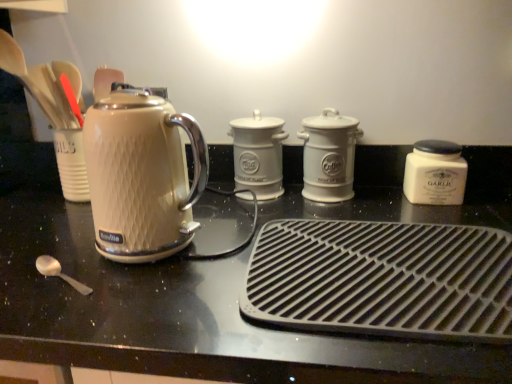
Identify the location of matte cream kettle at left. Image resolution: width=512 pixels, height=384 pixels. pyautogui.click(x=141, y=175).

Describe the element at coordinates (174, 308) in the screenshot. The height and width of the screenshot is (384, 512). I see `matte white kettle at left` at that location.

Measure the distance between white ceramic canister at center, arranged as the fourth kitchen appliance when viewed from the front, and camera.

white ceramic canister at center, arranged as the fourth kitchen appliance when viewed from the front, and camera are 34.98 inches apart.

Find the location of `white ceramic coffee canister at center, acting as the 2th kitchen appliance starting from the back`. white ceramic coffee canister at center, acting as the 2th kitchen appliance starting from the back is located at coordinates (329, 156).

Identify the location of black rubber mat at center, placed as the fourth kitchen appliance when sorted from back to front. (382, 279).

You are a GUI agent. You are given a task and a screenshot of the screen. Output one action in this format:
    pyautogui.click(x=<x>, y=<y>)
    Task: Click on the matte cream kettle at left
    
    Given the screenshot: What is the action you would take?
    pyautogui.click(x=141, y=175)

Is white ceramic jar at right, which is counted as the third kitchen appliance, starting from the back, to the left of white ceramic canister at center, arranged as the fourth kitchen appliance when viewed from the front, from the viewer's perspective?

In fact, white ceramic jar at right, which is counted as the third kitchen appliance, starting from the back, is to the right of white ceramic canister at center, arranged as the fourth kitchen appliance when viewed from the front.

Is white ceramic jar at right, acting as the 2th kitchen appliance starting from the front, next to white ceramic canister at center, placed as the 1th kitchen appliance when sorted from back to front, and touching it?

No, white ceramic jar at right, acting as the 2th kitchen appliance starting from the front, is not next to white ceramic canister at center, placed as the 1th kitchen appliance when sorted from back to front.

From the image's perspective, between white ceramic jar at right, acting as the 2th kitchen appliance starting from the front, and white ceramic canister at center, arranged as the fourth kitchen appliance when viewed from the front, who is located below?

white ceramic jar at right, acting as the 2th kitchen appliance starting from the front, is shown below in the image.

In the scene shown: From the image's perspective, which is above, black rubber mat at center, which is the first kitchen appliance from front to back, or white ceramic jar at right, which is counted as the third kitchen appliance, starting from the back?

white ceramic jar at right, which is counted as the third kitchen appliance, starting from the back.

Between black rubber mat at center, placed as the fourth kitchen appliance when sorted from back to front, and white ceramic jar at right, acting as the 2th kitchen appliance starting from the front, which one has smaller width?

Thinner between the two is white ceramic jar at right, acting as the 2th kitchen appliance starting from the front.

Measure the distance from black rubber mat at center, placed as the fourth kitchen appliance when sorted from back to front, to white ceramic jar at right, which is counted as the third kitchen appliance, starting from the back.

black rubber mat at center, placed as the fourth kitchen appliance when sorted from back to front, is 12.39 inches from white ceramic jar at right, which is counted as the third kitchen appliance, starting from the back.

From the picture: Considering the relative sizes of black rubber mat at center, which is the first kitchen appliance from front to back, and white ceramic jar at right, which is counted as the third kitchen appliance, starting from the back, in the image provided, is black rubber mat at center, which is the first kitchen appliance from front to back, taller than white ceramic jar at right, which is counted as the third kitchen appliance, starting from the back,?

No, black rubber mat at center, which is the first kitchen appliance from front to back, is not taller than white ceramic jar at right, which is counted as the third kitchen appliance, starting from the back.

Can matte white kettle at left be found inside white ceramic canister at center, arranged as the fourth kitchen appliance when viewed from the front?

No, matte white kettle at left is not inside white ceramic canister at center, arranged as the fourth kitchen appliance when viewed from the front.

In the image, is white ceramic canister at center, arranged as the fourth kitchen appliance when viewed from the front, positioned in front of or behind matte white kettle at left?

Visually, white ceramic canister at center, arranged as the fourth kitchen appliance when viewed from the front, is located behind matte white kettle at left.

From the image's perspective, would you say white ceramic canister at center, arranged as the fourth kitchen appliance when viewed from the front, is shown under matte white kettle at left?

Incorrect, from the image's perspective, white ceramic canister at center, arranged as the fourth kitchen appliance when viewed from the front, is higher than matte white kettle at left.

Considering the relative sizes of white ceramic canister at center, arranged as the fourth kitchen appliance when viewed from the front, and matte white kettle at left in the image provided, is white ceramic canister at center, arranged as the fourth kitchen appliance when viewed from the front, taller than matte white kettle at left?

Incorrect, the height of white ceramic canister at center, arranged as the fourth kitchen appliance when viewed from the front, is not larger of that of matte white kettle at left.

From a real-world perspective, between white ceramic coffee canister at center, the 3th kitchen appliance viewed from the front, and white ceramic canister at center, placed as the 1th kitchen appliance when sorted from back to front, who is vertically higher?

white ceramic canister at center, placed as the 1th kitchen appliance when sorted from back to front, is physically above.

The height and width of the screenshot is (384, 512). What are the coordinates of `the 1st kitchen appliance to the right when counting from the white ceramic canister at center, arranged as the fourth kitchen appliance when viewed from the front` in the screenshot? It's located at (329, 156).

Could you measure the distance between white ceramic coffee canister at center, acting as the 2th kitchen appliance starting from the back, and white ceramic canister at center, arranged as the fourth kitchen appliance when viewed from the front?

white ceramic coffee canister at center, acting as the 2th kitchen appliance starting from the back, is 4.21 inches from white ceramic canister at center, arranged as the fourth kitchen appliance when viewed from the front.

Can you see white ceramic coffee canister at center, acting as the 2th kitchen appliance starting from the back, touching white ceramic canister at center, placed as the 1th kitchen appliance when sorted from back to front?

There is a gap between white ceramic coffee canister at center, acting as the 2th kitchen appliance starting from the back, and white ceramic canister at center, placed as the 1th kitchen appliance when sorted from back to front.

In terms of size, does black rubber mat at center, placed as the fourth kitchen appliance when sorted from back to front, appear bigger or smaller than white ceramic canister at center, arranged as the fourth kitchen appliance when viewed from the front?

Considering their sizes, black rubber mat at center, placed as the fourth kitchen appliance when sorted from back to front, takes up more space than white ceramic canister at center, arranged as the fourth kitchen appliance when viewed from the front.

Which object is positioned more to the left, black rubber mat at center, which is the first kitchen appliance from front to back, or white ceramic canister at center, arranged as the fourth kitchen appliance when viewed from the front?

From the viewer's perspective, white ceramic canister at center, arranged as the fourth kitchen appliance when viewed from the front, appears more on the left side.

Between black rubber mat at center, which is the first kitchen appliance from front to back, and white ceramic canister at center, arranged as the fourth kitchen appliance when viewed from the front, which one is positioned in front?

Positioned in front is black rubber mat at center, which is the first kitchen appliance from front to back.

Is black rubber mat at center, placed as the fourth kitchen appliance when sorted from back to front, with white ceramic canister at center, arranged as the fourth kitchen appliance when viewed from the front?

No, black rubber mat at center, placed as the fourth kitchen appliance when sorted from back to front, is not touching white ceramic canister at center, arranged as the fourth kitchen appliance when viewed from the front.

Is white ceramic canister at center, placed as the 1th kitchen appliance when sorted from back to front, bigger or smaller than white ceramic coffee canister at center, the 3th kitchen appliance viewed from the front?

white ceramic canister at center, placed as the 1th kitchen appliance when sorted from back to front, is smaller than white ceramic coffee canister at center, the 3th kitchen appliance viewed from the front.

Which of these two, white ceramic canister at center, placed as the 1th kitchen appliance when sorted from back to front, or white ceramic coffee canister at center, the 3th kitchen appliance viewed from the front, stands shorter?

With less height is white ceramic canister at center, placed as the 1th kitchen appliance when sorted from back to front.

Could you tell me if white ceramic canister at center, placed as the 1th kitchen appliance when sorted from back to front, is facing white ceramic coffee canister at center, the 3th kitchen appliance viewed from the front?

No, white ceramic canister at center, placed as the 1th kitchen appliance when sorted from back to front, is not turned towards white ceramic coffee canister at center, the 3th kitchen appliance viewed from the front.

Can you see white ceramic canister at center, placed as the 1th kitchen appliance when sorted from back to front, touching white ceramic coffee canister at center, acting as the 2th kitchen appliance starting from the back?

No, white ceramic canister at center, placed as the 1th kitchen appliance when sorted from back to front, is not in contact with white ceramic coffee canister at center, acting as the 2th kitchen appliance starting from the back.

Which point is more forward, (229,134) or (440,200)?

The point (440,200) is more forward.

From the image's perspective, between white ceramic canister at center, placed as the 1th kitchen appliance when sorted from back to front, and white ceramic jar at right, which is counted as the third kitchen appliance, starting from the back, which one is located above?

white ceramic canister at center, placed as the 1th kitchen appliance when sorted from back to front.

This screenshot has height=384, width=512. Identify the location of the 3rd kitchen appliance to the right of the white ceramic canister at center, placed as the 1th kitchen appliance when sorted from back to front, starting your count from the anchor. (435, 173).

Is white ceramic canister at center, placed as the 1th kitchen appliance when sorted from back to front, not inside white ceramic jar at right, which is counted as the third kitchen appliance, starting from the back?

That's correct, white ceramic canister at center, placed as the 1th kitchen appliance when sorted from back to front, is outside of white ceramic jar at right, which is counted as the third kitchen appliance, starting from the back.

Locate an element on the screen. the 2nd kitchen appliance behind the white ceramic jar at right, which is counted as the third kitchen appliance, starting from the back is located at coordinates (258, 154).

Where is `kitchen appliance on the right of black rubber mat at center, which is the first kitchen appliance from front to back`? The width and height of the screenshot is (512, 384). kitchen appliance on the right of black rubber mat at center, which is the first kitchen appliance from front to back is located at coordinates (435, 173).

From the image, which object appears to be nearer to white ceramic coffee canister at center, the 3th kitchen appliance viewed from the front, white ceramic jar at right, which is counted as the third kitchen appliance, starting from the back, or matte white kettle at left?

The object closer to white ceramic coffee canister at center, the 3th kitchen appliance viewed from the front, is white ceramic jar at right, which is counted as the third kitchen appliance, starting from the back.

Considering their positions, is white ceramic jar at right, which is counted as the third kitchen appliance, starting from the back, positioned further to matte cream kettle at left than black rubber mat at center, placed as the fourth kitchen appliance when sorted from back to front?

Among the two, white ceramic jar at right, which is counted as the third kitchen appliance, starting from the back, is located further to matte cream kettle at left.

Considering their positions, is white ceramic coffee canister at center, acting as the 2th kitchen appliance starting from the back, positioned further to matte cream kettle at left than white ceramic jar at right, which is counted as the third kitchen appliance, starting from the back?

The object further to matte cream kettle at left is white ceramic jar at right, which is counted as the third kitchen appliance, starting from the back.

Looking at the image, which one is located further to white ceramic jar at right, acting as the 2th kitchen appliance starting from the front, black rubber mat at center, which is the first kitchen appliance from front to back, or matte cream kettle at left?

matte cream kettle at left.

From the image, which object appears to be farther from white ceramic canister at center, arranged as the fourth kitchen appliance when viewed from the front, black rubber mat at center, placed as the fourth kitchen appliance when sorted from back to front, or matte white kettle at left?

The object further to white ceramic canister at center, arranged as the fourth kitchen appliance when viewed from the front, is black rubber mat at center, placed as the fourth kitchen appliance when sorted from back to front.

When comparing their distances from matte white kettle at left, does black rubber mat at center, placed as the fourth kitchen appliance when sorted from back to front, or white ceramic jar at right, acting as the 2th kitchen appliance starting from the front, seem further?

white ceramic jar at right, acting as the 2th kitchen appliance starting from the front.

Which object lies nearer to the anchor point matte cream kettle at left, white ceramic coffee canister at center, acting as the 2th kitchen appliance starting from the back, or black rubber mat at center, placed as the fourth kitchen appliance when sorted from back to front?

Based on the image, black rubber mat at center, placed as the fourth kitchen appliance when sorted from back to front, appears to be nearer to matte cream kettle at left.

Considering their positions, is matte white kettle at left positioned further to white ceramic coffee canister at center, the 3th kitchen appliance viewed from the front, than white ceramic canister at center, arranged as the fourth kitchen appliance when viewed from the front?

Among the two, matte white kettle at left is located further to white ceramic coffee canister at center, the 3th kitchen appliance viewed from the front.

Locate an element on the screen. This screenshot has height=384, width=512. kitchen appliance between matte cream kettle at left and matte white kettle at left in the up-down direction is located at coordinates (382, 279).

Where is `kettle positioned between black rubber mat at center, placed as the fourth kitchen appliance when sorted from back to front, and white ceramic canister at center, arranged as the fourth kitchen appliance when viewed from the front, from near to far`? This screenshot has height=384, width=512. kettle positioned between black rubber mat at center, placed as the fourth kitchen appliance when sorted from back to front, and white ceramic canister at center, arranged as the fourth kitchen appliance when viewed from the front, from near to far is located at coordinates (141, 175).

Identify the location of kettle that lies between white ceramic coffee canister at center, the 3th kitchen appliance viewed from the front, and matte white kettle at left from top to bottom. The width and height of the screenshot is (512, 384). (141, 175).

Find the location of a particular element. This screenshot has width=512, height=384. kettle situated between matte white kettle at left and white ceramic jar at right, acting as the 2th kitchen appliance starting from the front, from left to right is located at coordinates (141, 175).